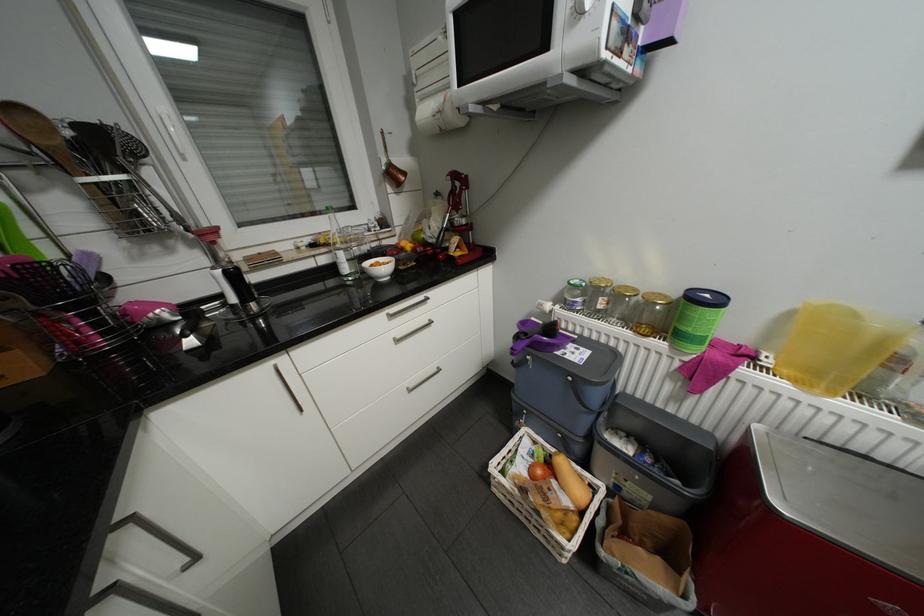
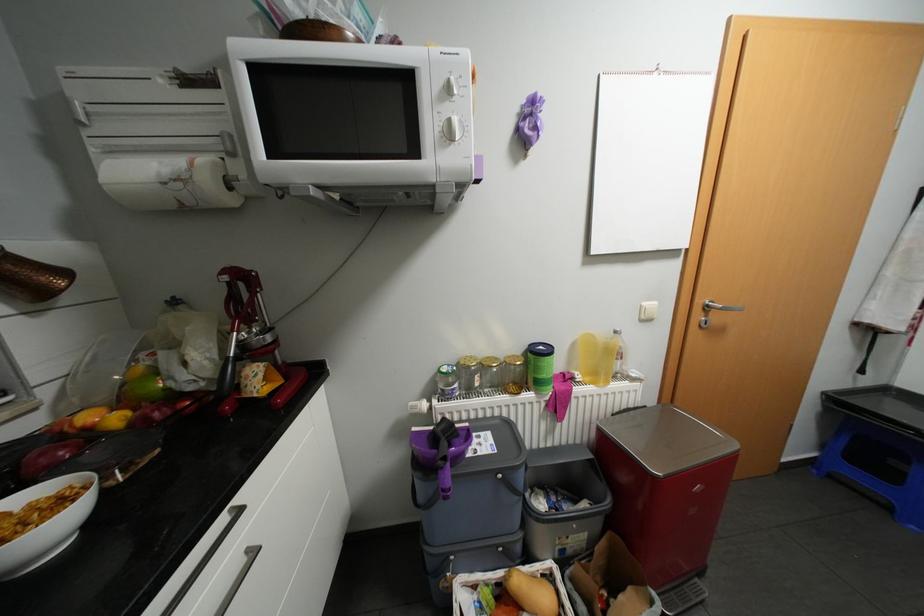
Locate, in the second image, the point that corresponds to point (417, 245) in the first image.

(123, 418)